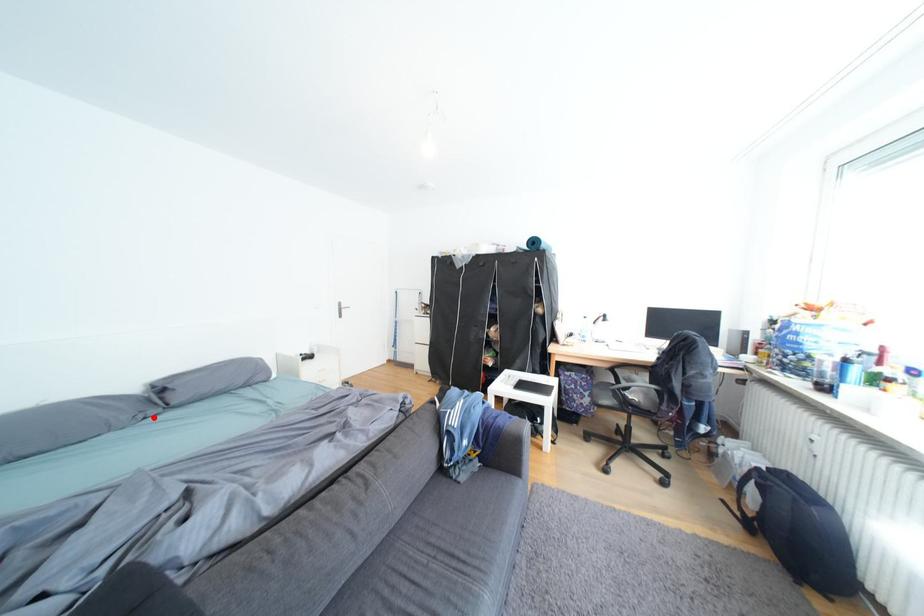
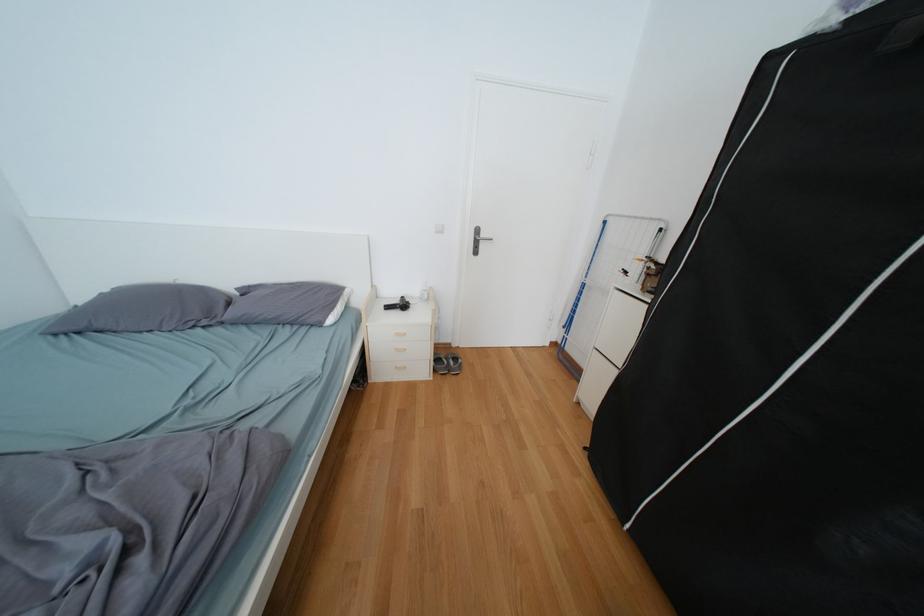
The point at the highlighted location is marked in the first image. Where is the corresponding point in the second image?

(204, 323)